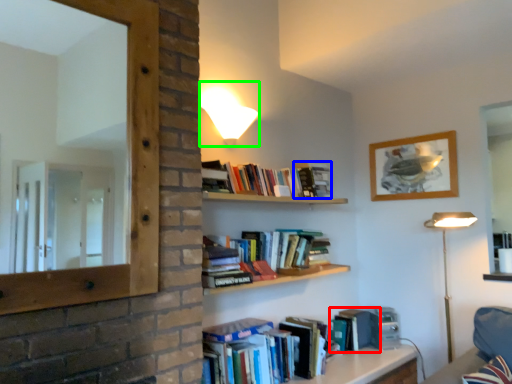
Question: Which is nearer to the paperback book (highlighted by a red box)? paperback book (highlighted by a blue box) or lamp (highlighted by a green box).

Choices:
 (A) paperback book
 (B) lamp

Answer: (A)